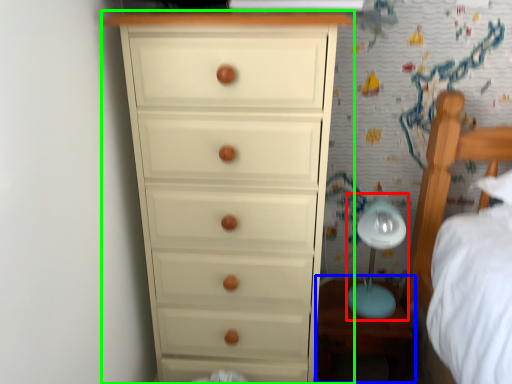
Question: Estimate the real-world distances between objects in this image. Which object is closer to table lamp (highlighted by a red box), table (highlighted by a blue box) or chest of drawers (highlighted by a green box)?

Choices:
 (A) table
 (B) chest of drawers

Answer: (A)